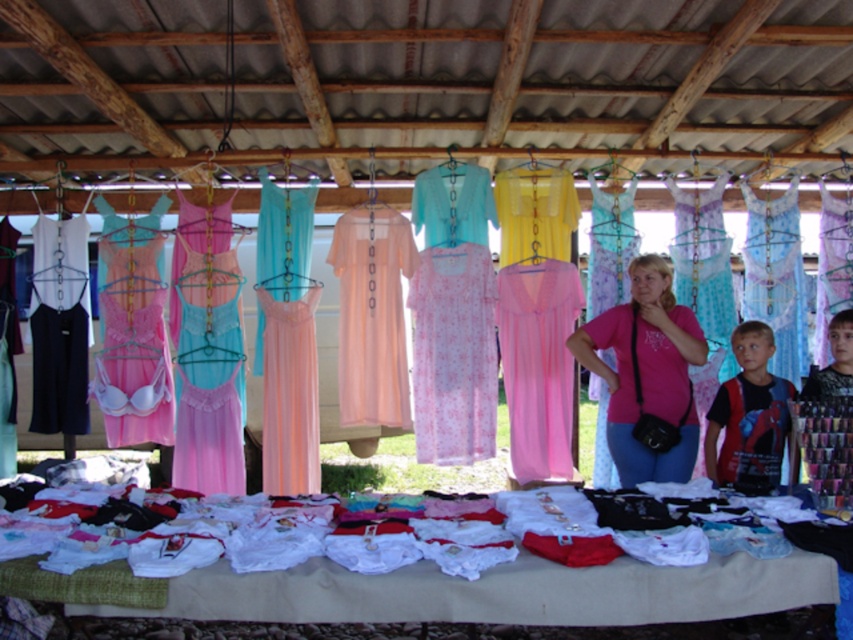
Can you confirm if pink sheer dress at center is positioned below pink satin nightgown at center?

No.

The height and width of the screenshot is (640, 853). What are the coordinates of `pink sheer dress at center` in the screenshot? It's located at (538, 364).

Identify the location of pink sheer dress at center. (538, 364).

The width and height of the screenshot is (853, 640). What do you see at coordinates (538, 364) in the screenshot? I see `pink sheer dress at center` at bounding box center [538, 364].

Between pink sheer dress at center and spiderman t-shirt at center, which one is positioned higher?

pink sheer dress at center is above.

What do you see at coordinates (538, 364) in the screenshot? Image resolution: width=853 pixels, height=640 pixels. I see `pink sheer dress at center` at bounding box center [538, 364].

The width and height of the screenshot is (853, 640). In order to click on pink sheer dress at center in this screenshot , I will do `click(538, 364)`.

How distant is pink floral fabric dress at center from smooth black t-shirt at right?

They are 1.58 meters apart.

Is point (486, 440) less distant than point (839, 314)?

That is False.

Image resolution: width=853 pixels, height=640 pixels. I want to click on pink floral fabric dress at center, so click(453, 355).